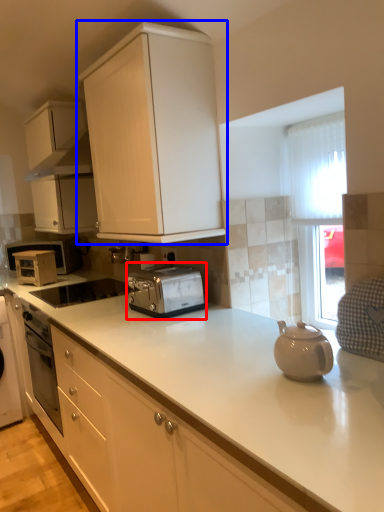
Question: Which of the following is the farthest to the observer, toaster (highlighted by a red box) or cabinetry (highlighted by a blue box)?

Choices:
 (A) toaster
 (B) cabinetry

Answer: (A)